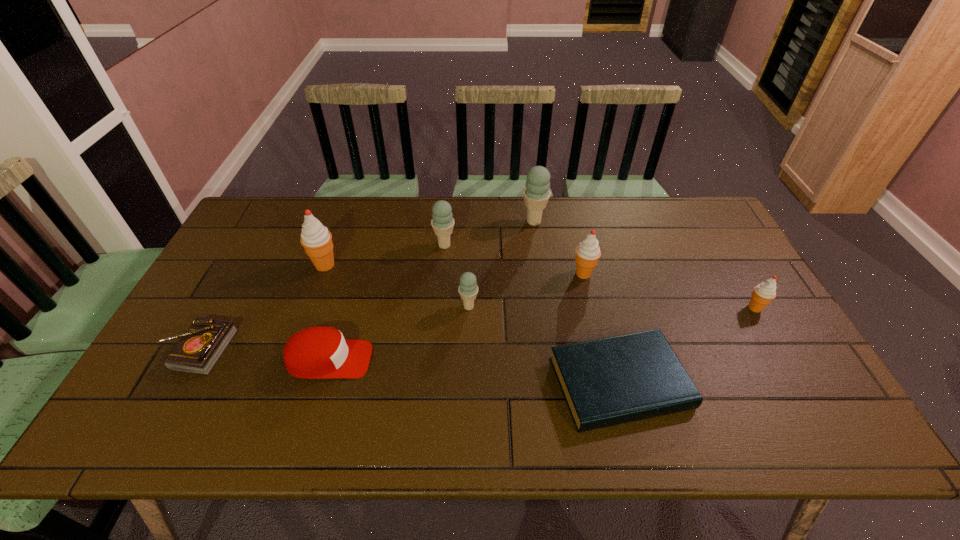
Identify the location of the fourth ice cream from right to left. (468, 289).

Where is `the second blue ice cream from left to right`? This screenshot has width=960, height=540. the second blue ice cream from left to right is located at coordinates (468, 289).

Locate an element on the screen. This screenshot has width=960, height=540. baseball cap is located at coordinates (320, 352).

Locate an element on the screen. Image resolution: width=960 pixels, height=540 pixels. the seventh tallest object is located at coordinates tap(320, 352).

Image resolution: width=960 pixels, height=540 pixels. Identify the location of diary. (199, 349).

Find the location of a particular element. book is located at coordinates (605, 382).

This screenshot has width=960, height=540. I want to click on vacant space located on the front of the farthest blue ice cream, so click(x=540, y=261).

This screenshot has height=540, width=960. Find the location of `free point located on the right of the leftmost ice cream`. free point located on the right of the leftmost ice cream is located at coordinates (469, 265).

Where is `vacant space positioned 0.240m on the left of the second ice cream from left to right`? The height and width of the screenshot is (540, 960). vacant space positioned 0.240m on the left of the second ice cream from left to right is located at coordinates (359, 245).

Find the location of `vacant space positioned on the back of the second red icecream from right to left`. vacant space positioned on the back of the second red icecream from right to left is located at coordinates click(570, 216).